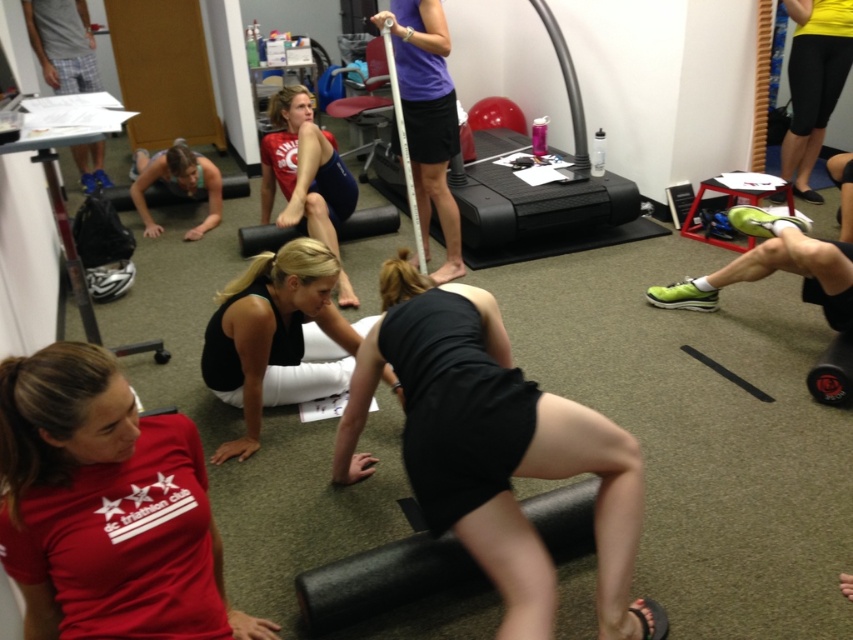
Question: Is red matte shirt at center wider than black matte shorts at center?

Choices:
 (A) yes
 (B) no

Answer: (B)

Question: Based on their relative distances, which object is farther from the black matte yoga mat at center?

Choices:
 (A) matte black squat at lower left
 (B) red matte shirt at center
 (C) black matte shorts at center

Answer: (A)

Question: Which point is closer to the camera taking this photo?

Choices:
 (A) (527, 557)
 (B) (30, 436)
 (C) (305, 172)

Answer: (B)

Question: Among these objects, which one is nearest to the camera?

Choices:
 (A) matte red tank top at center
 (B) matte black squat at lower left

Answer: (A)

Question: Does matte red tank top at center have a smaller size compared to yellow matte shorts at upper right?

Choices:
 (A) no
 (B) yes

Answer: (A)

Question: Can you confirm if matte red tank top at center is positioned below matte black squat at lower left?

Choices:
 (A) yes
 (B) no

Answer: (A)